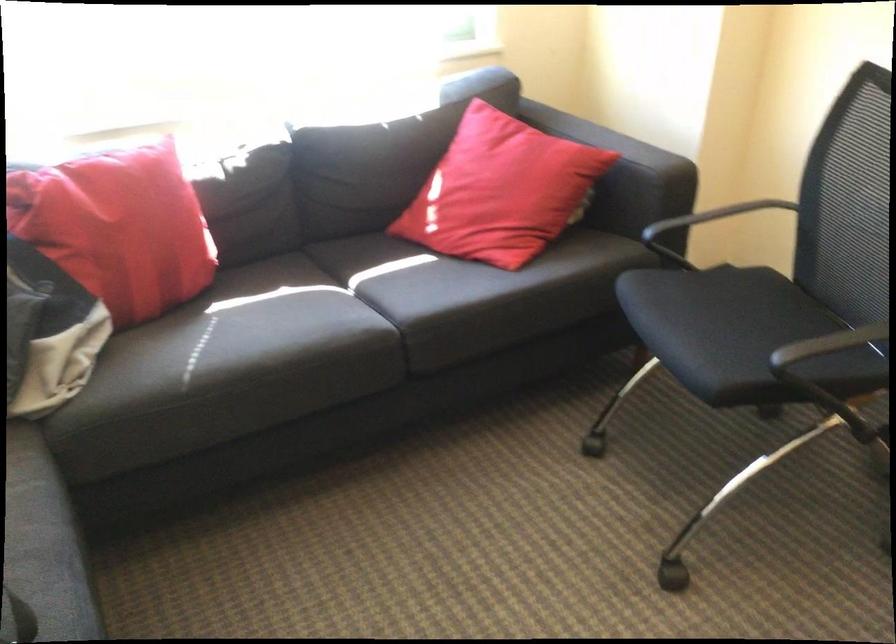
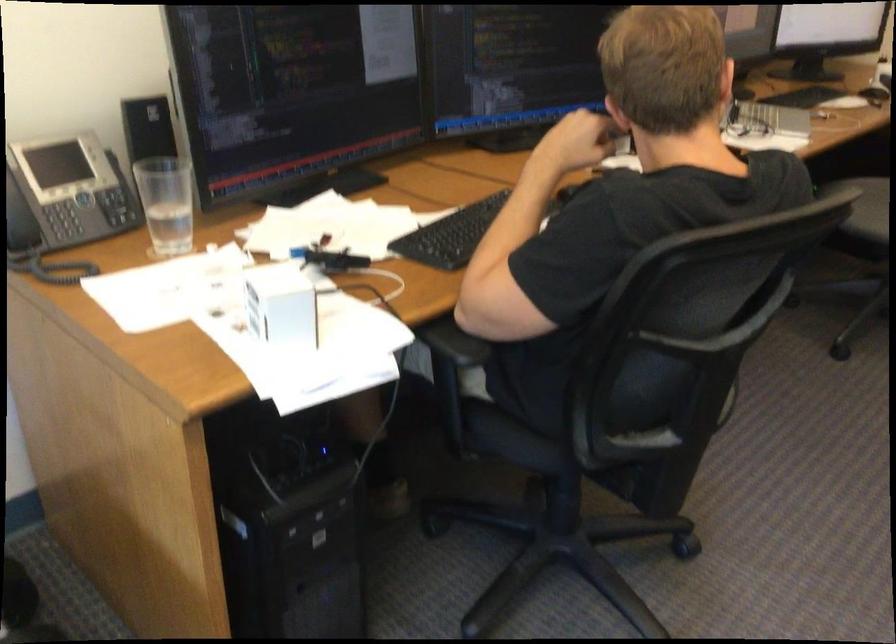
The first image is from the beginning of the video and the second image is from the end. How did the camera likely rotate when shooting the video?

The camera's rotation is toward right-down.